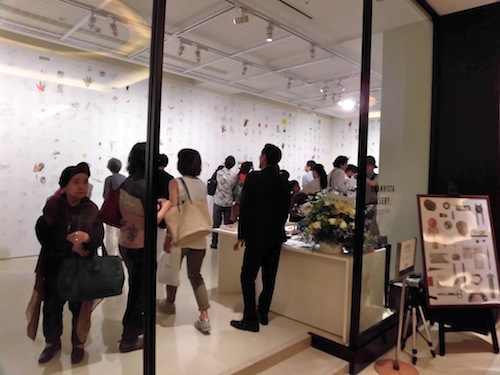
You are a GUI agent. You are given a task and a screenshot of the screen. Output one action in this format:
    pyautogui.click(x=<x>, y=<y>)
    Task: Click on the glass wall
    
    Given the screenshot: What is the action you would take?
    pyautogui.click(x=392, y=146), pyautogui.click(x=31, y=262)